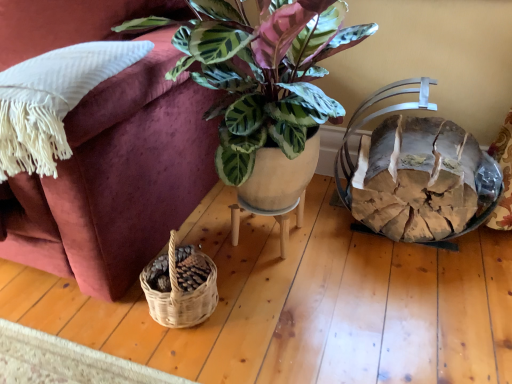
Question: Can you see matte ceramic plant at center touching matte ceramic pot at center?

Choices:
 (A) no
 (B) yes

Answer: (A)

Question: Is matte ceramic plant at center smaller than matte ceramic pot at center?

Choices:
 (A) yes
 (B) no

Answer: (B)

Question: From the image's perspective, does matte ceramic plant at center appear higher than matte ceramic pot at center?

Choices:
 (A) no
 (B) yes

Answer: (B)

Question: Is matte ceramic pot at center completely or partially inside matte ceramic plant at center?

Choices:
 (A) yes
 (B) no

Answer: (B)

Question: Does matte ceramic plant at center lie behind matte ceramic pot at center?

Choices:
 (A) yes
 (B) no

Answer: (B)

Question: Is matte ceramic plant at center aimed at matte ceramic pot at center?

Choices:
 (A) no
 (B) yes

Answer: (A)

Question: Is the depth of rustic wood log basket at right less than that of matte ceramic pot at center?

Choices:
 (A) yes
 (B) no

Answer: (A)

Question: From the image's perspective, is rustic wood log basket at right over matte ceramic pot at center?

Choices:
 (A) yes
 (B) no

Answer: (A)

Question: Can you confirm if rustic wood log basket at right is thinner than matte ceramic pot at center?

Choices:
 (A) yes
 (B) no

Answer: (B)

Question: Considering the relative positions of rustic wood log basket at right and matte ceramic pot at center in the image provided, is rustic wood log basket at right to the right of matte ceramic pot at center from the viewer's perspective?

Choices:
 (A) no
 (B) yes

Answer: (B)

Question: Does rustic wood log basket at right turn towards matte ceramic pot at center?

Choices:
 (A) no
 (B) yes

Answer: (A)

Question: Is rustic wood log basket at right not inside matte ceramic pot at center?

Choices:
 (A) yes
 (B) no

Answer: (A)

Question: Would you say matte ceramic plant at center is a long distance from white fringed pillow at left?

Choices:
 (A) yes
 (B) no

Answer: (B)